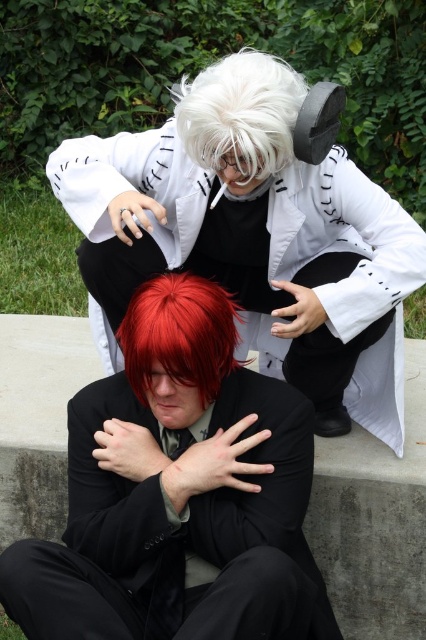
You are a costume designer assessing the spatial arrangement of two costume elements in the image. The white matte coat at upper center and the shiny red hair at center are both visible. Which costume element has a greater width?

The white matte coat at upper center has a greater width than the shiny red hair at center, as stated in the description.

You are a photographer trying to capture a closeup shot of both the white matte wig at upper center and the shiny red hair at center. Since you want both subjects to appear equally sized in the photo, which subject should you move closer to the camera?

The white matte wig at upper center is bigger than the shiny red hair at center, so you should move closer to the shiny red hair at center to make them appear the same size in the photo.

You are a costume designer assessing the spatial compatibility of two costume elements. You have the white matte coat at upper center and the shiny red hair at center. Which element occupies more space in the visual composition?

The white matte coat at upper center is larger in size than the shiny red hair at center, so it occupies more space in the visual composition.